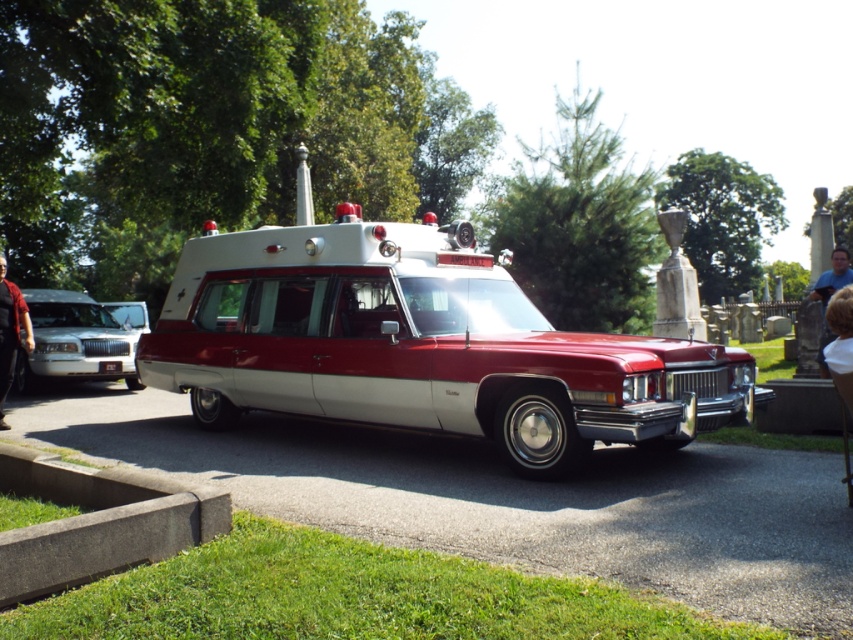
You are standing in front of the vintage hearse parked in the cemetery. There are two points marked on the hearse. The first point is at coordinate point [201,410] and the second is at point [67,305]. Which point is closer to you?

Point [201,410] is closer to the viewer than point [67,305].

You are standing at the point with coordinates point (9, 296) and want to walk towards the point with coordinates point (821, 340). Based on the scene, will you be walking towards or away from the cemetery tombstones in the background?

Since point (9, 296) is in front of point (821, 340), walking towards point (821, 340) would mean walking away from the cemetery tombstones in the background.

You are a parking attendant who needs to move the shiny red hearse at center and the white glossy sedan at left into a parking garage. The garage has a clearance height of 2.5 meters. Can both vehicles fit through the entrance without any modifications?

The question cannot be answered with the provided information as the height of the shiny red hearse at center and white glossy sedan at left is not mentioned in the descriptions.